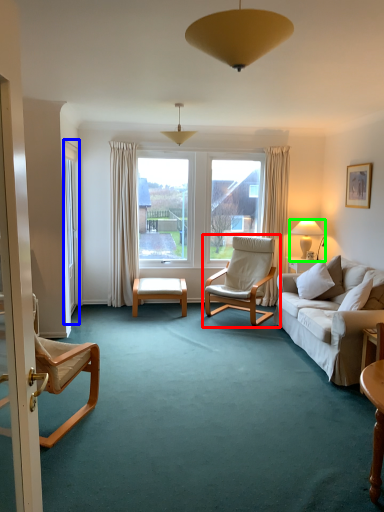
Question: Based on their relative distances, which object is farther from chair (highlighted by a red box)? Choose from screen door (highlighted by a blue box) and lamp (highlighted by a green box).

Choices:
 (A) screen door
 (B) lamp

Answer: (A)